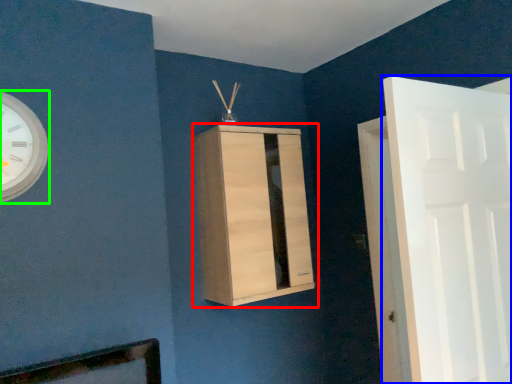
Question: Which object is positioned closest to cupboard (highlighted by a red box)? Select from door (highlighted by a blue box) and wall clock (highlighted by a green box).

Choices:
 (A) door
 (B) wall clock

Answer: (A)